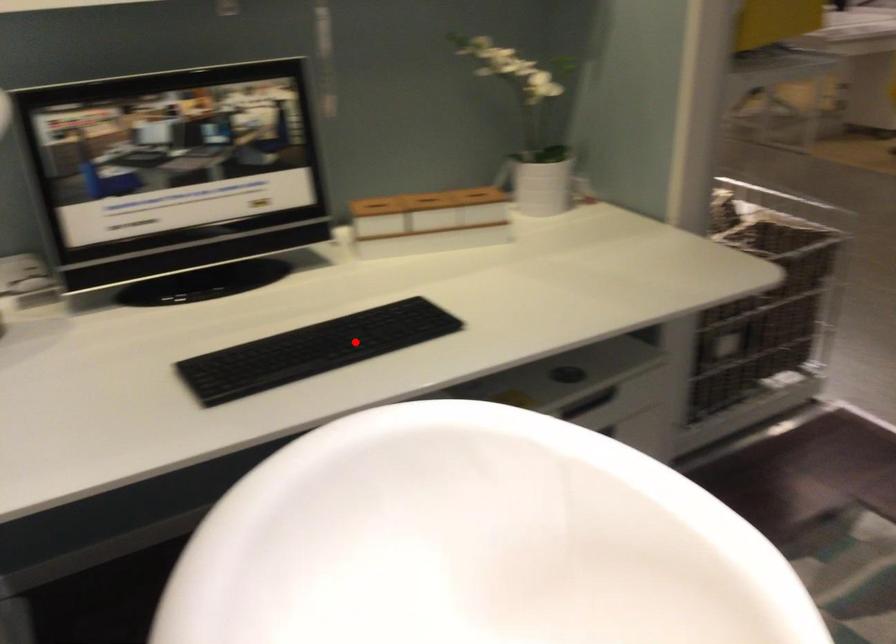
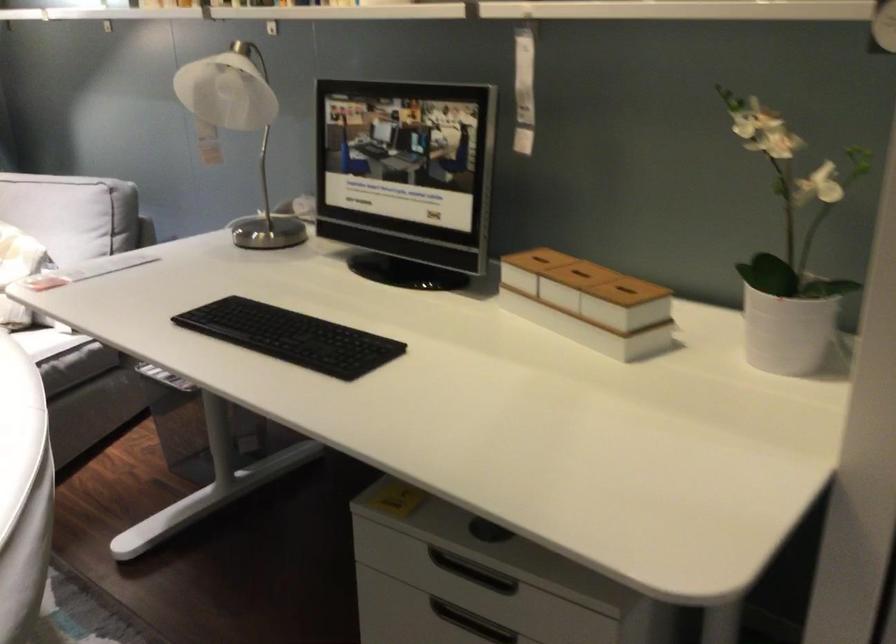
Find the pixel in the second image that matches the highlighted location in the first image.

(291, 337)